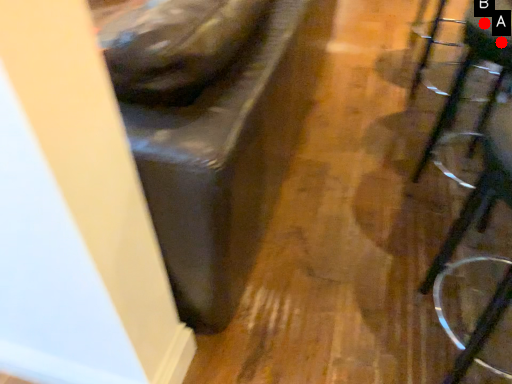
Question: Two points are circled on the image, labeled by A and B beside each circle. Which point is closer to the camera?

Choices:
 (A) A is closer
 (B) B is closer

Answer: (A)